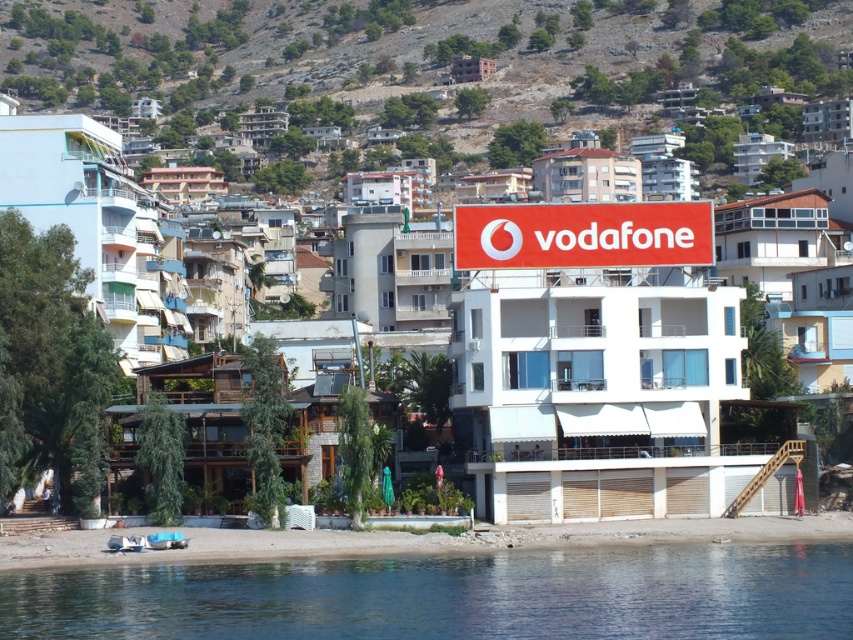
Question: Can you confirm if white matte building at center is thinner than red matte sign at center?

Choices:
 (A) yes
 (B) no

Answer: (B)

Question: Which of these objects is positioned farthest from the red matte sign at center?

Choices:
 (A) smooth sand beach at lower center
 (B) transparent blue water at lower center

Answer: (B)

Question: Which object is positioned farthest from the white matte building at center?

Choices:
 (A) smooth sand beach at lower center
 (B) transparent blue water at lower center
 (C) red matte sign at center
 (D) green leafy hillside at upper center

Answer: (D)

Question: Can you confirm if transparent blue water at lower center is positioned to the right of red matte sign at center?

Choices:
 (A) no
 (B) yes

Answer: (A)

Question: Which object is the closest to the green leafy hillside at upper center?

Choices:
 (A) white matte building at center
 (B) red matte sign at center

Answer: (A)

Question: Is white matte building at center further to camera compared to red matte sign at center?

Choices:
 (A) no
 (B) yes

Answer: (A)